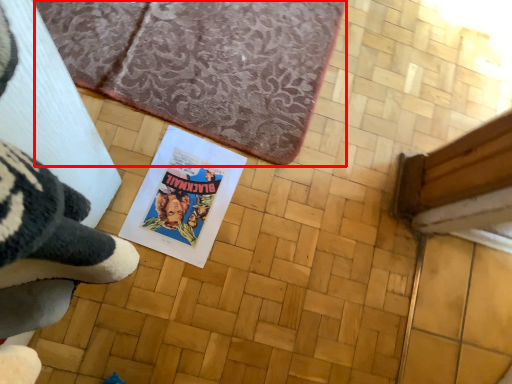
Question: From the image, what is the correct spatial relationship of bath mat (annotated by the red box) in relation to paperback book?

Choices:
 (A) left
 (B) right

Answer: (B)